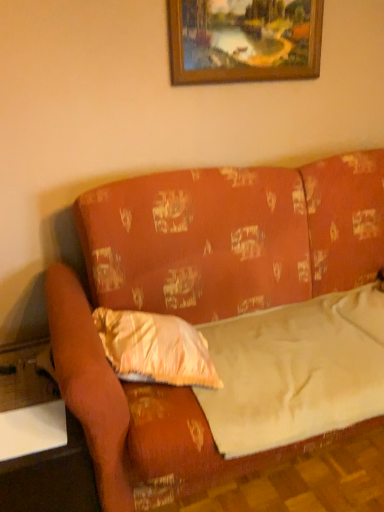
Question: Is point (110, 312) closer or farther from the camera than point (24, 475)?

Choices:
 (A) farther
 (B) closer

Answer: (A)

Question: Is shiny gold pillow at center-left spatially inside wooden glossy table at lower left, the first table in the bottom-to-top sequence, or outside of it?

Choices:
 (A) inside
 (B) outside

Answer: (B)

Question: Which object is positioned closest to the orange fabric couch at center?

Choices:
 (A) white plastic table at lower left, arranged as the 2th table when ordered from the bottom
 (B) wooden glossy table at lower left, the first table in the bottom-to-top sequence
 (C) white fabric sheet at center
 (D) shiny gold pillow at center-left
 (E) wooden frame at upper center

Answer: (D)

Question: Which is farther from the white fabric sheet at center?

Choices:
 (A) shiny gold pillow at center-left
 (B) wooden glossy table at lower left, positioned as the second table in top-to-bottom order
 (C) wooden frame at upper center
 (D) white plastic table at lower left, which is counted as the first table, starting from the top
 (E) orange fabric couch at center

Answer: (C)